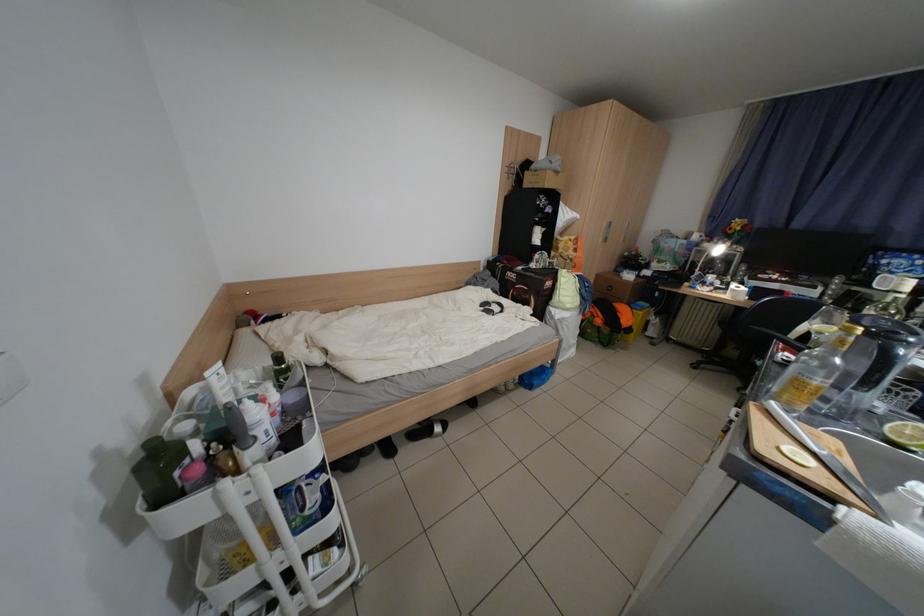
Find where to pull the white cart handle. Please return your answer as a coordinate pair (x, y).

(266, 538)